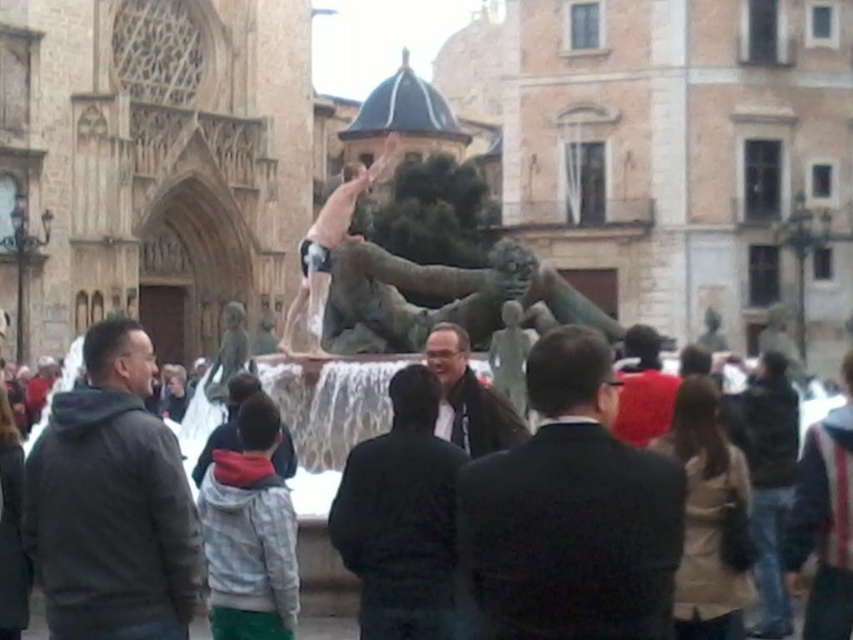
Who is higher up, dark brown suit at center or matte gray statue at center?

dark brown suit at center is above.

Does dark brown suit at center appear under matte gray statue at center?

No.

Identify the location of dark brown suit at center. Image resolution: width=853 pixels, height=640 pixels. (572, 512).

Identify the location of dark brown suit at center. (572, 512).

Is matte gray statue at center bigger than dark gray suit at center?

Yes, matte gray statue at center is bigger than dark gray suit at center.

Find the location of `matte gray statue at center`. matte gray statue at center is located at coordinates (318, 548).

Which of these two, bronze statue at center or matte gray statue at center, stands taller?

With more height is bronze statue at center.

This screenshot has height=640, width=853. What do you see at coordinates (413, 288) in the screenshot?
I see `bronze statue at center` at bounding box center [413, 288].

Find the location of a particular element. This screenshot has width=853, height=640. bronze statue at center is located at coordinates (413, 288).